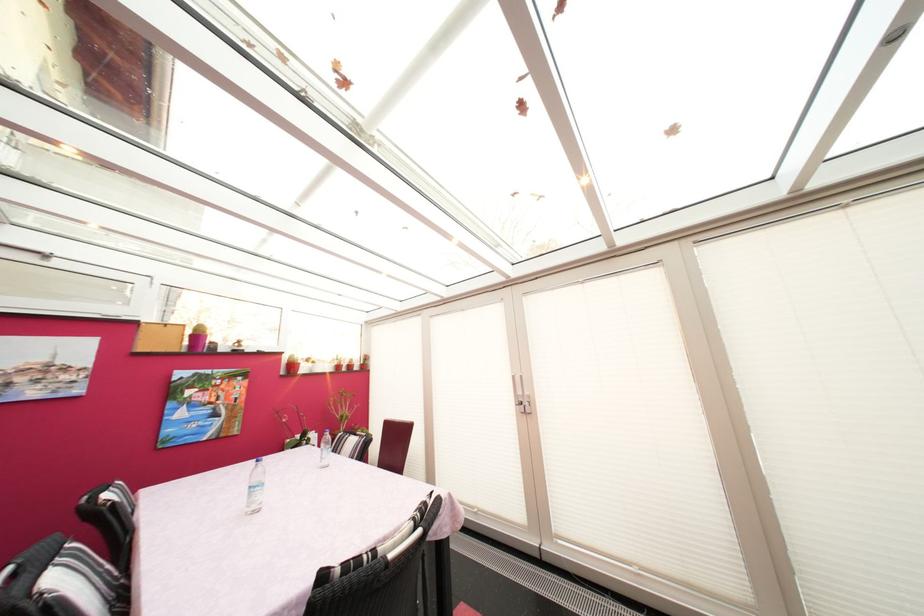
Identify the location of silver door handle. (520, 394).